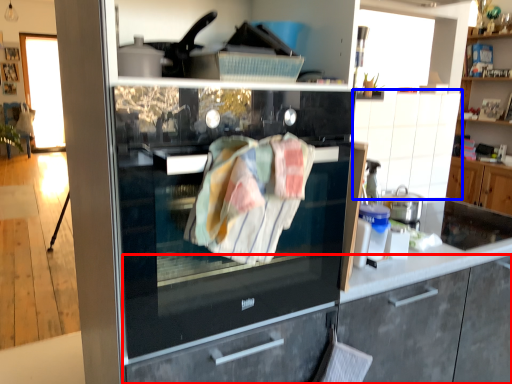
Question: Among these objects, which one is farthest to the camera, cabinetry (highlighted by a red box) or cabinetry (highlighted by a blue box)?

Choices:
 (A) cabinetry
 (B) cabinetry

Answer: (B)